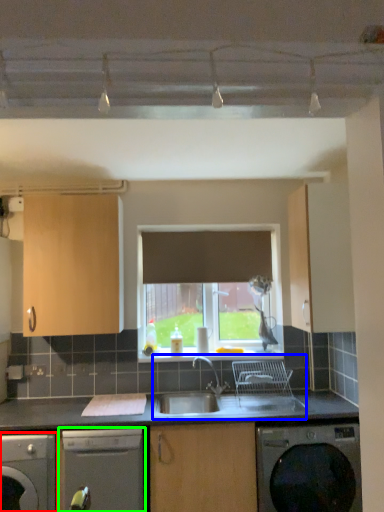
Question: Estimate the real-world distances between objects in this image. Which object is farther from dishwasher (highlighted by a red box), sink (highlighted by a blue box) or dishwasher (highlighted by a green box)?

Choices:
 (A) sink
 (B) dishwasher

Answer: (A)